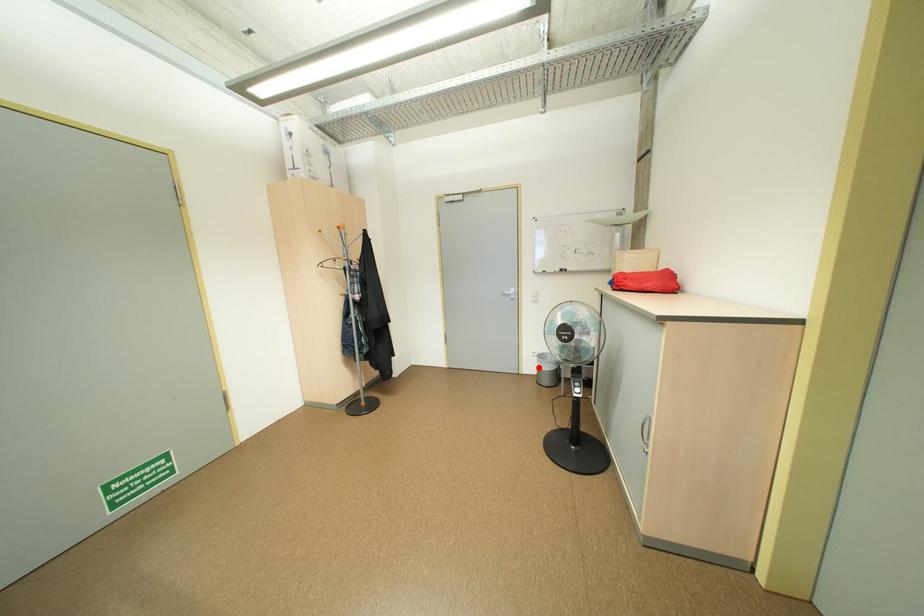
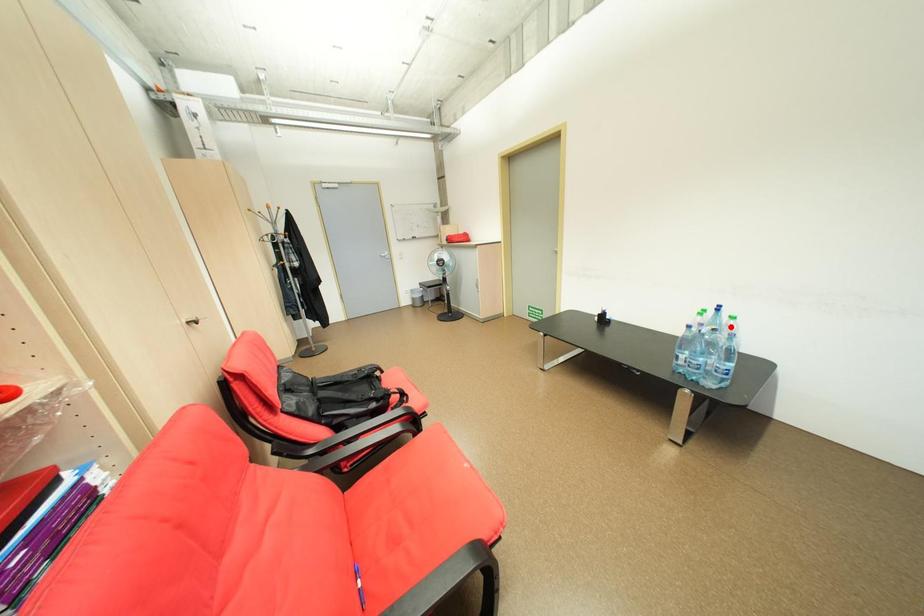
I am providing you with two images of the same scene from different viewpoints. A red point is marked on the first image and another point is marked on the second image. Is the red point in image1 aligned with the point shown in image2?

No